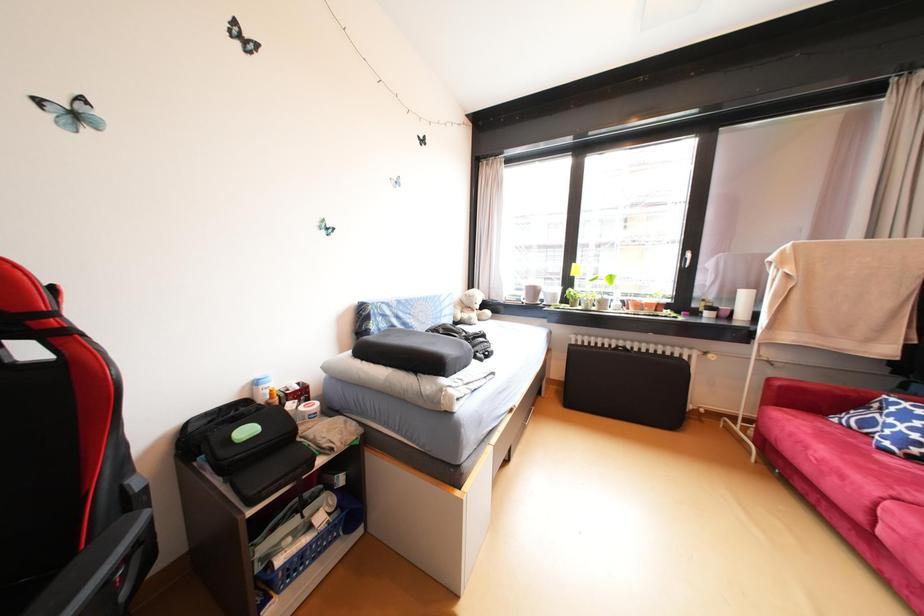
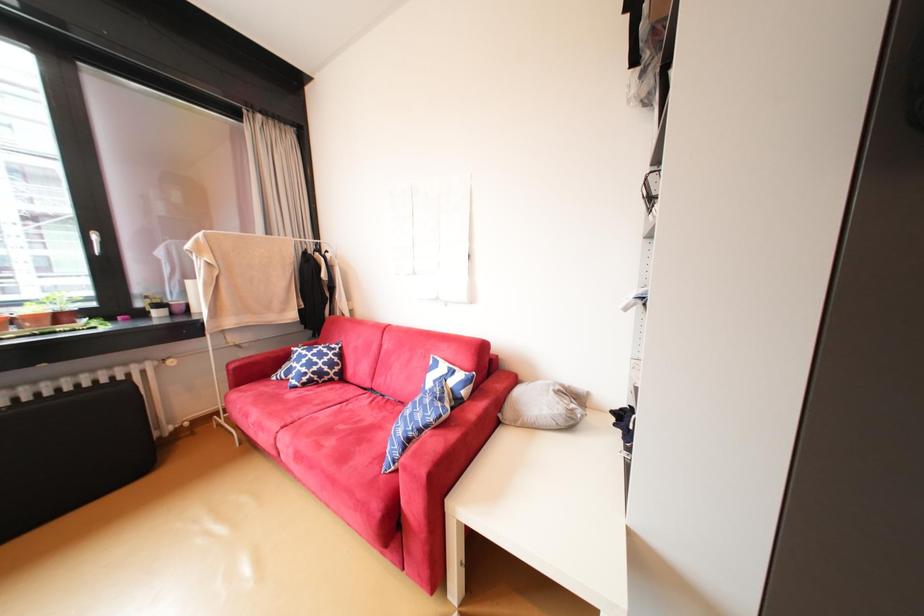
Question: The camera is either moving clockwise (left) or counter-clockwise (right) around the object. The first image is from the beginning of the video and the second image is from the end. Is the camera moving left or right when shooting the video?

Choices:
 (A) Left
 (B) Right

Answer: (A)